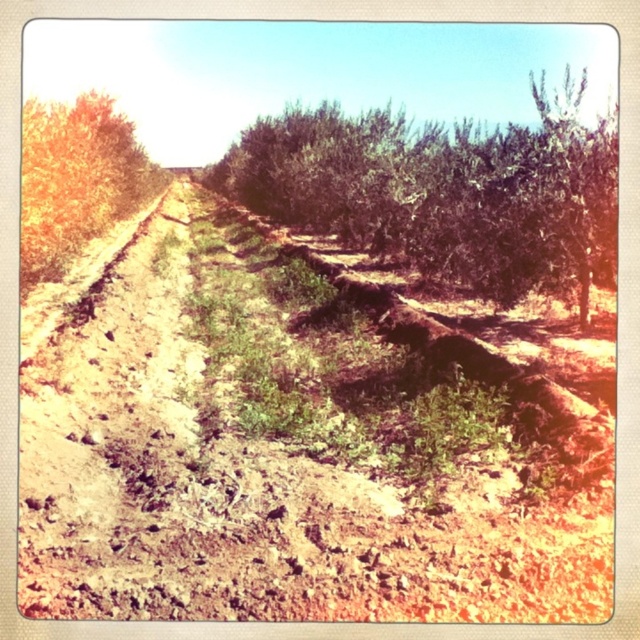
Does point (253, 244) lie in front of point (38, 156)?

No, (253, 244) is further to viewer.

Is brown soil at center thinner than green leafy tree at left?

Indeed, brown soil at center has a lesser width compared to green leafy tree at left.

You are a GUI agent. You are given a task and a screenshot of the screen. Output one action in this format:
    pyautogui.click(x=<x>, y=<y>)
    Task: Click on the brown soil at center
    This screenshot has width=640, height=640.
    Given the screenshot: What is the action you would take?
    pyautogui.click(x=296, y=445)

Which is in front, point (333, 160) or point (147, 161)?

Positioned in front is point (333, 160).

This screenshot has width=640, height=640. Find the location of `green leafy shrub at center`. green leafy shrub at center is located at coordinates (445, 193).

Measure the distance from brown soil at center to green leafy shrub at center.

61.66 feet

Which is more to the right, brown soil at center or green leafy shrub at center?

green leafy shrub at center is more to the right.

Does point (486, 516) lie behind point (566, 234)?

No, it is not.

Where is `brown soil at center`? The image size is (640, 640). brown soil at center is located at coordinates (296, 445).